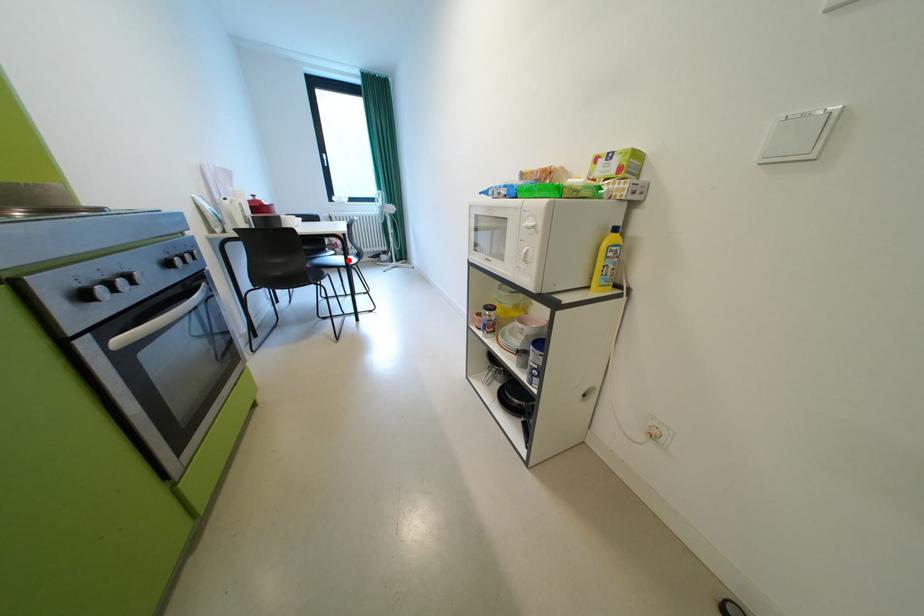
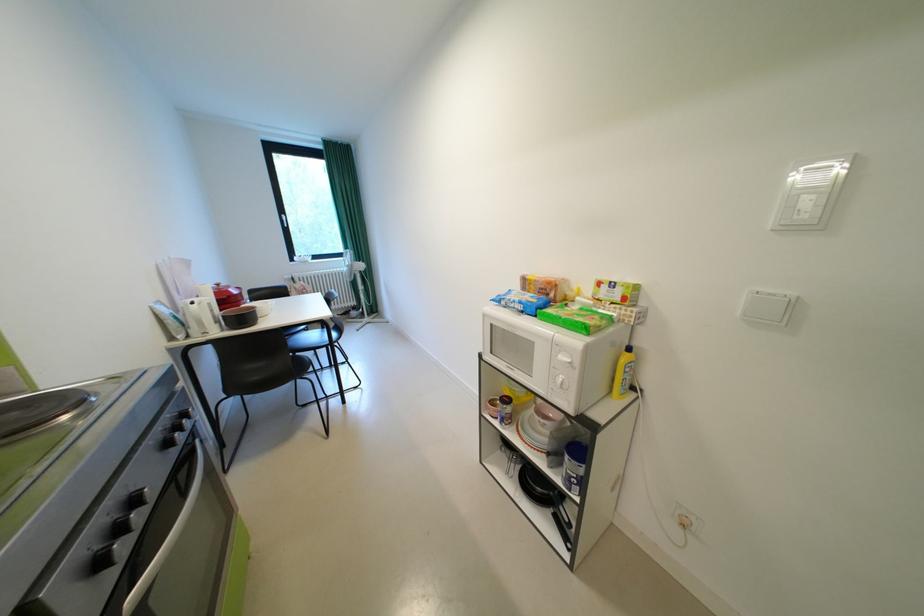
Question: I am providing you with two images of the same scene from different viewpoints. Image1 has a red point marked. In image2, the corresponding 3D location appears at what relative position? Reply with the corresponding letter.

Choices:
 (A) Closer
 (B) Farther

Answer: (A)